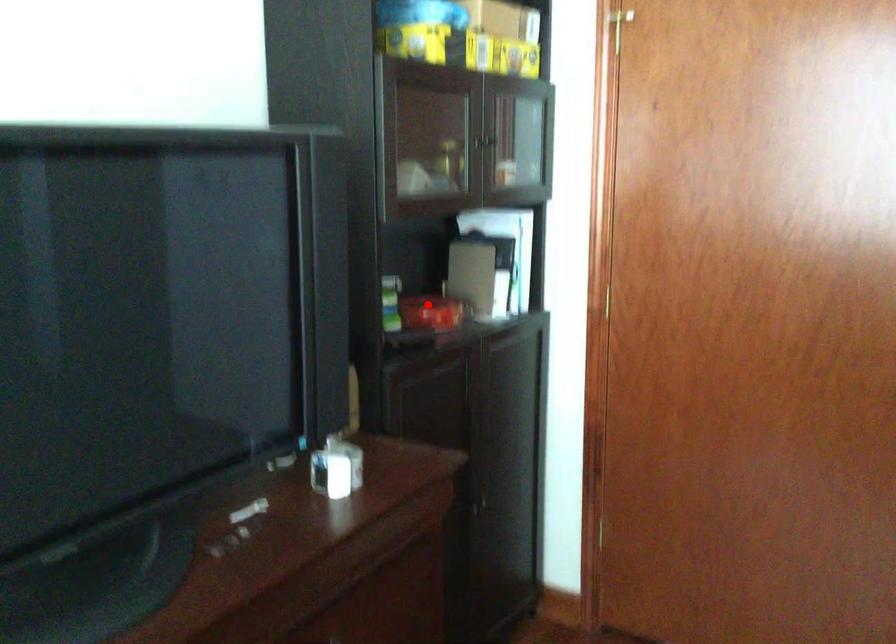
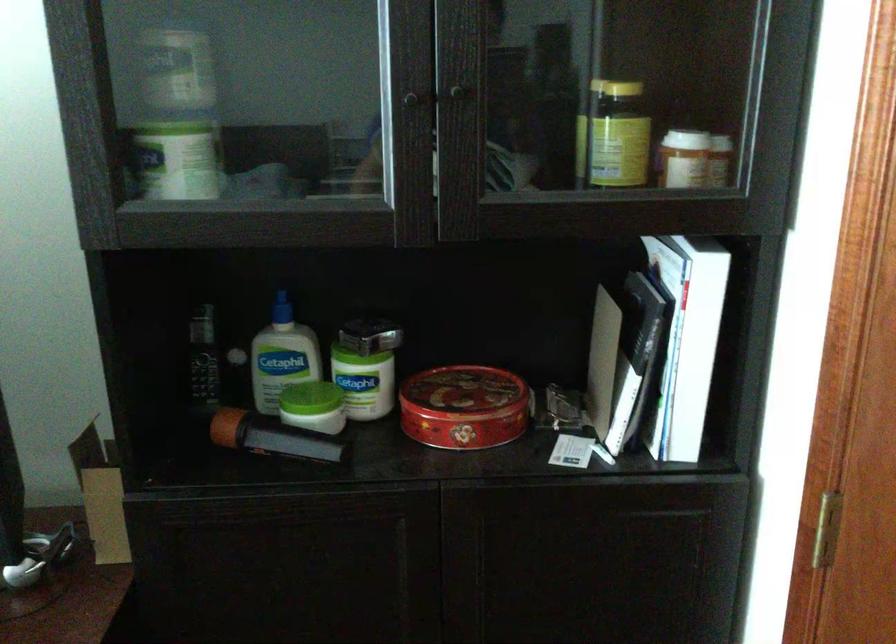
Question: I am providing you with two images of the same scene from different viewpoints. Given a red point in image1, look at the same physical point in image2. Is it:

Choices:
 (A) Closer to the viewpoint
 (B) Farther from the viewpoint

Answer: (A)